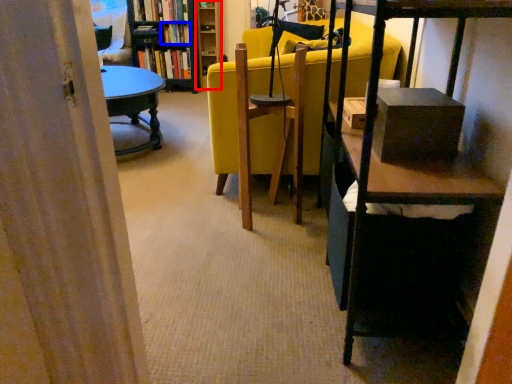
Question: Among these objects, which one is nearest to the camera, shelf (highlighted by a red box) or book (highlighted by a blue box)?

Choices:
 (A) shelf
 (B) book

Answer: (A)